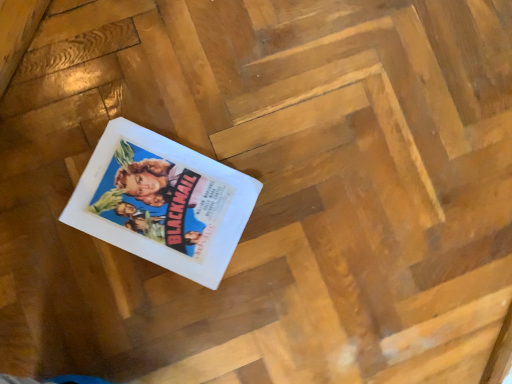
What are the coordinates of `vacant area that is situated to the right of white paper at center` in the screenshot? It's located at (260, 291).